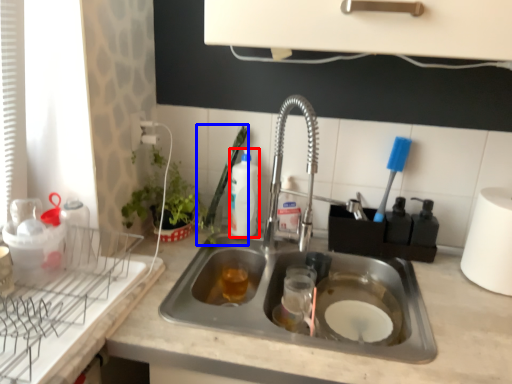
Question: Which of the following is the closest to the observer, beverage (highlighted by a red box) or brush (highlighted by a blue box)?

Choices:
 (A) beverage
 (B) brush

Answer: (B)